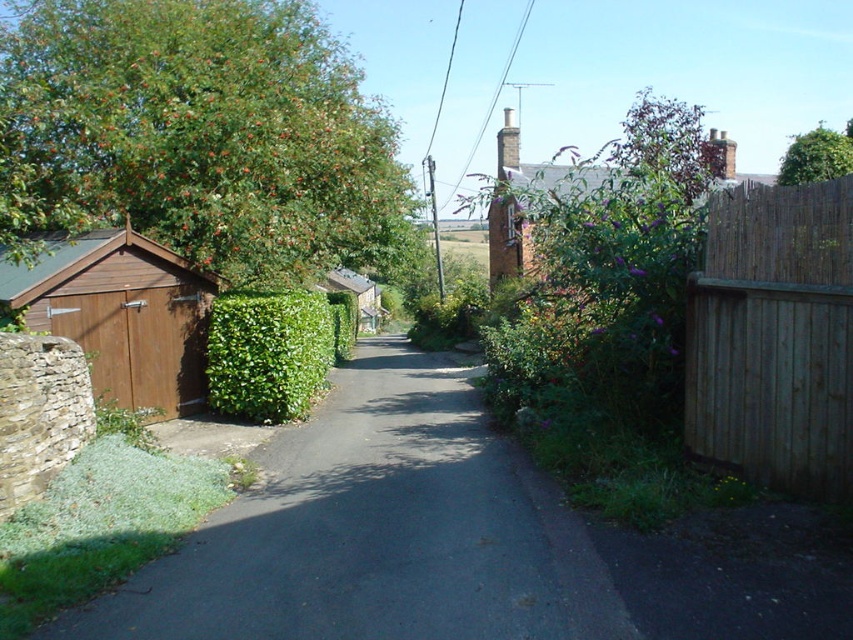
Question: Which of the following is the closest to the observer?

Choices:
 (A) green leafy tree at upper right
 (B) brown wooden shed at left

Answer: (B)

Question: Is brown wooden shed at left to the right of green leafy hedge at center from the viewer's perspective?

Choices:
 (A) yes
 (B) no

Answer: (B)

Question: Is the position of brown wooden fence at right more distant than that of green leafy hedge at center?

Choices:
 (A) yes
 (B) no

Answer: (B)

Question: Is brown wooden shed at left to the right of green leafy bush at upper right from the viewer's perspective?

Choices:
 (A) no
 (B) yes

Answer: (A)

Question: Among these objects, which one is nearest to the camera?

Choices:
 (A) green leafy tree at left
 (B) brown wooden shed at left

Answer: (B)

Question: Which of these objects is positioned closest to the dark asphalt road at center?

Choices:
 (A) green leafy tree at upper right
 (B) green leafy bush at upper right
 (C) brown wooden fence at right
 (D) brown wooden shed at left

Answer: (C)